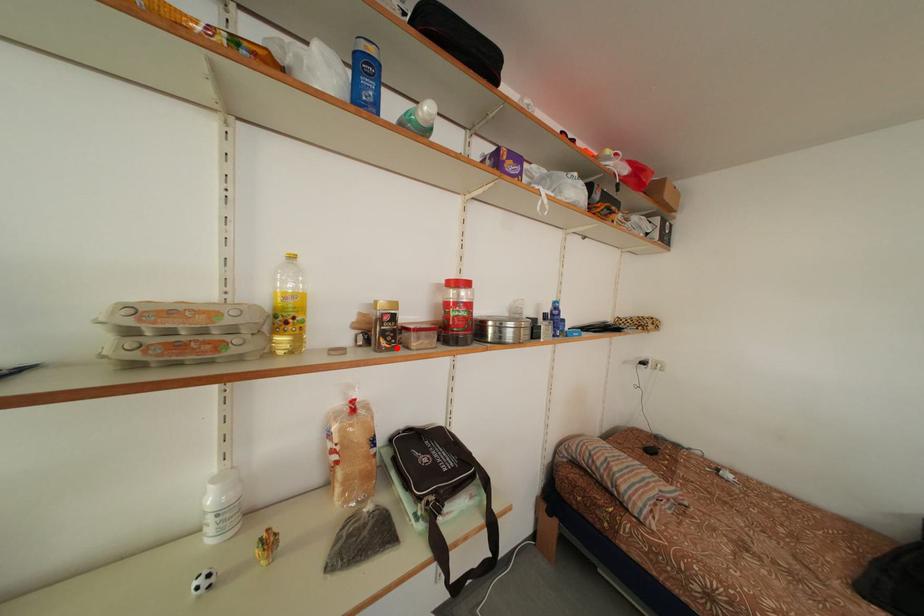
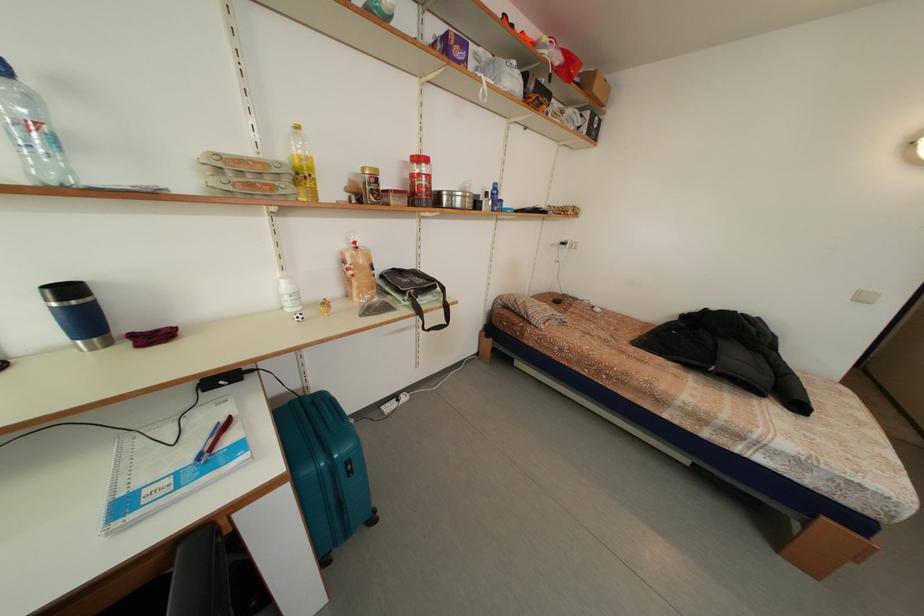
Question: I am providing you with two images of the same scene from different viewpoints. A red point is marked on the first image. Can you still see the location of the red point in image 2?

Choices:
 (A) Yes
 (B) No

Answer: (A)